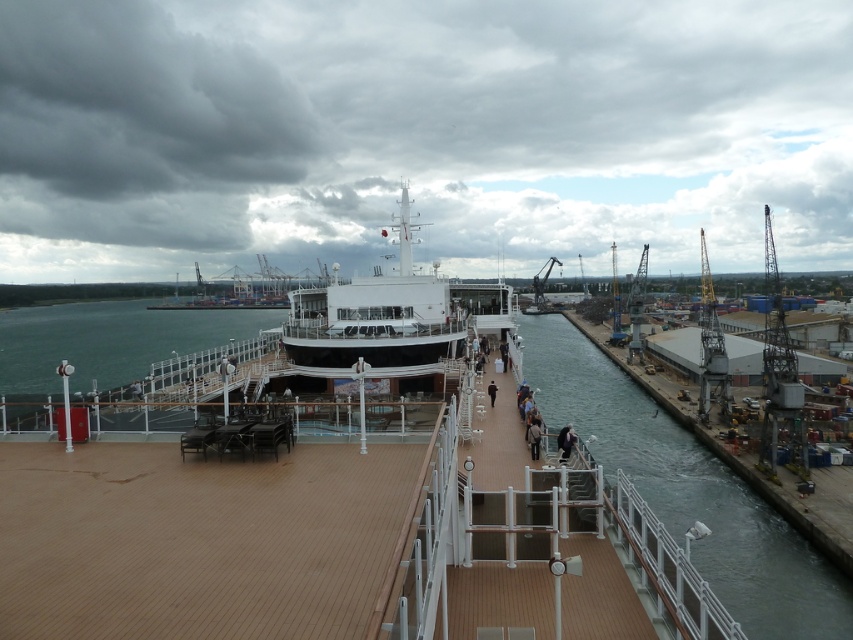
In the scene shown: Which is more to the left, dark brown leather jacket at center or brown leather jacket at center?

brown leather jacket at center

This screenshot has width=853, height=640. What do you see at coordinates (532, 436) in the screenshot?
I see `dark brown leather jacket at center` at bounding box center [532, 436].

Is point (531, 440) positioned before point (494, 387)?

Yes.

You are a GUI agent. You are given a task and a screenshot of the screen. Output one action in this format:
    pyautogui.click(x=<x>, y=<y>)
    Task: Click on the dark brown leather jacket at center
    
    Given the screenshot: What is the action you would take?
    pyautogui.click(x=532, y=436)

Does dark blue fabric jacket at center appear on the left side of dark brown leather jacket at center?

No, dark blue fabric jacket at center is not to the left of dark brown leather jacket at center.

Can you confirm if dark blue fabric jacket at center is positioned to the right of dark brown leather jacket at center?

Correct, you'll find dark blue fabric jacket at center to the right of dark brown leather jacket at center.

Which is in front, point (564, 428) or point (537, 420)?

Point (537, 420) is in front.

I want to click on dark blue fabric jacket at center, so click(566, 440).

You are a GUI agent. You are given a task and a screenshot of the screen. Output one action in this format:
    pyautogui.click(x=<x>, y=<y>)
    Task: Click on the clear water at dock right
    The height and width of the screenshot is (640, 853).
    Given the screenshot: What is the action you would take?
    pyautogui.click(x=688, y=490)

Is clear water at dock right smaller than dark brown leather jacket at center?

Actually, clear water at dock right might be larger than dark brown leather jacket at center.

This screenshot has width=853, height=640. I want to click on clear water at dock right, so click(688, 490).

Where is `clear water at dock right`? Image resolution: width=853 pixels, height=640 pixels. clear water at dock right is located at coordinates (688, 490).